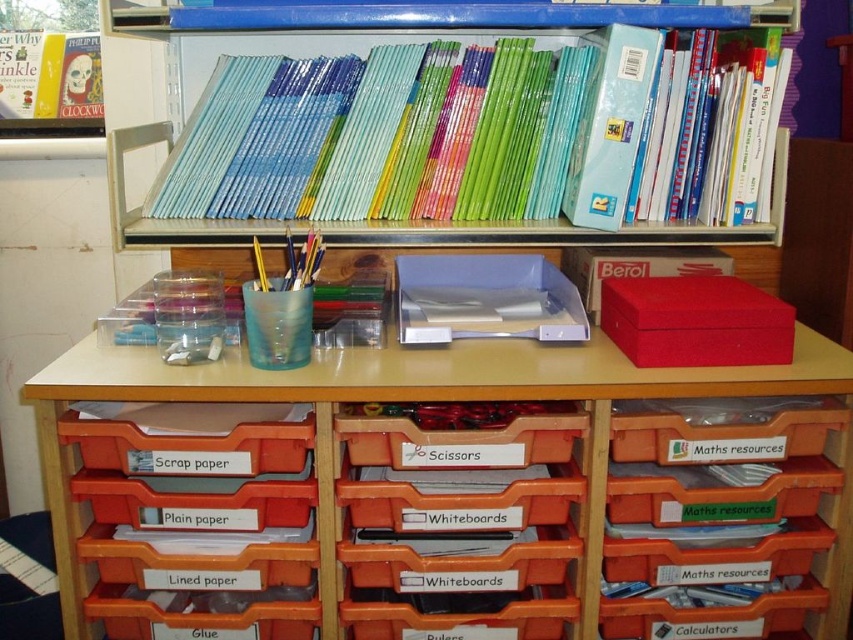
Question: Which point is closer to the camera?

Choices:
 (A) (375, 166)
 (B) (473, 356)

Answer: (B)

Question: Can you confirm if orange plastic tray at lower left is positioned above hardcover book at upper left?

Choices:
 (A) no
 (B) yes

Answer: (A)

Question: Which object appears closest to the camera in this image?

Choices:
 (A) hardcover book at upper left
 (B) orange plastic tray at lower left
 (C) matte plastic table at center
 (D) blue plastic books at upper center

Answer: (C)

Question: Which is nearer to the blue plastic books at upper center?

Choices:
 (A) hardcover book at upper left
 (B) translucent plastic tray at lower right
 (C) matte plastic table at center
 (D) orange plastic tray at lower left

Answer: (C)

Question: Observing the image, what is the correct spatial positioning of translucent plastic tray at lower right in reference to matte plastic table at center?

Choices:
 (A) below
 (B) above

Answer: (A)

Question: Can you confirm if translucent plastic tray at lower right is thinner than matte plastic table at center?

Choices:
 (A) no
 (B) yes

Answer: (B)